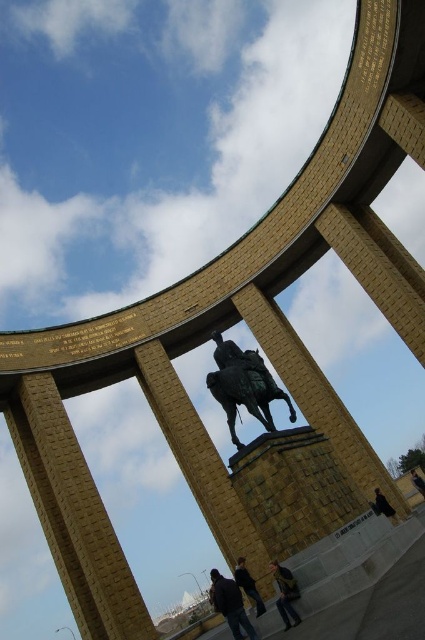
Question: Is denim jacket at lower center bigger than dark blue jacket at center?

Choices:
 (A) yes
 (B) no

Answer: (B)

Question: Which point is closer to the camera?

Choices:
 (A) (241, 608)
 (B) (286, 612)

Answer: (B)

Question: Estimate the real-world distances between objects in this image. Which object is farther from the denim jacket at lower center?

Choices:
 (A) dark blue jeans at lower center
 (B) dark blue jacket at center

Answer: (A)

Question: Can you confirm if shiny bronze horse at center is wider than dark blue jeans at lower center?

Choices:
 (A) no
 (B) yes

Answer: (B)

Question: Can you confirm if shiny bronze horse at center is positioned below dark blue jacket at center?

Choices:
 (A) no
 (B) yes

Answer: (A)

Question: Among these points, which one is nearest to the camera?

Choices:
 (A) (x=229, y=624)
 (B) (x=263, y=392)
 (C) (x=249, y=577)
 (D) (x=295, y=593)

Answer: (D)